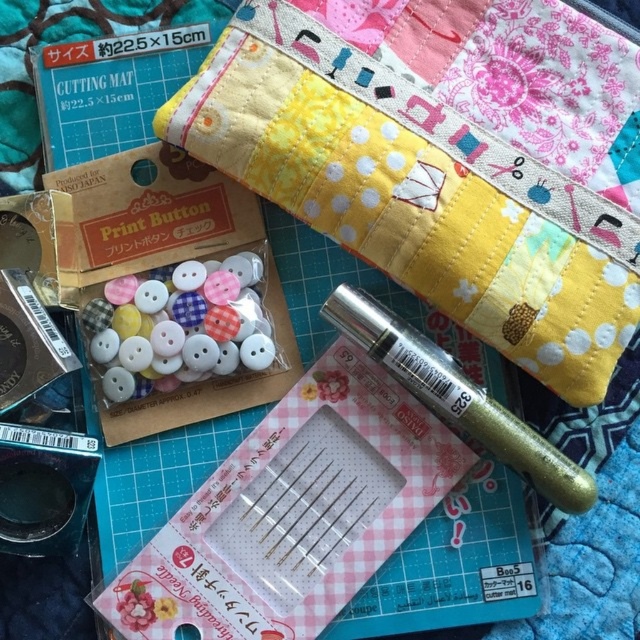
In the scene shown: You are organizing a craft kit and need to place the gold glitter pen at upper center and the gold glitter pen at center into a storage box. Which pen should you pick up first to avoid blocking the other?

You should pick up the gold glitter pen at upper center first because it is closer to you and picking it up first will prevent blocking access to the gold glitter pen at center which is behind it.

You are organizing a craft kit and need to stack the gold glitter pen at upper center and the gold glitter pen at center vertically. Which pen should you place at the bottom to ensure stability?

The gold glitter pen at upper center is taller than the gold glitter pen at center, so placing it at the bottom would provide better stability due to its greater height.